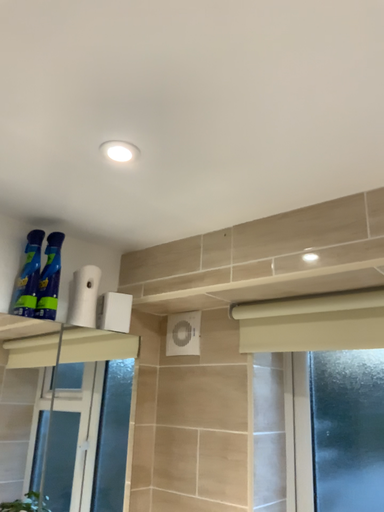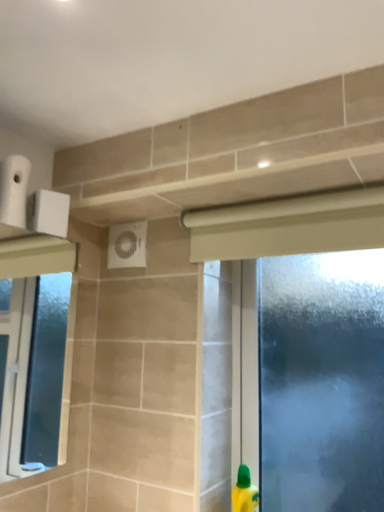
Question: How did the camera likely rotate when shooting the video?

Choices:
 (A) rotated downward
 (B) rotated upward

Answer: (A)